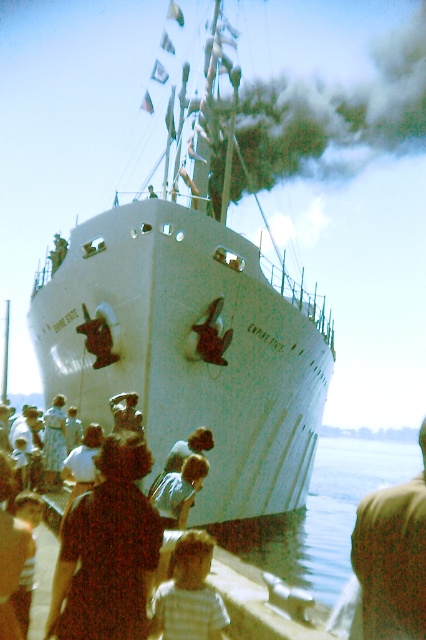
Question: Which is farther from the clear water at lower center?

Choices:
 (A) brown fabric at lower right
 (B) light brown fabric shirt at center

Answer: (A)

Question: Which point is farther to the camera?

Choices:
 (A) brown fabric at lower right
 (B) light brown fabric shirt at center
 (C) white matte ship at center
 (D) floral dress at lower left

Answer: (C)

Question: Does floral dress at lower left have a larger size compared to brown fabric at lower right?

Choices:
 (A) no
 (B) yes

Answer: (A)

Question: Which object is closer to the camera taking this photo?

Choices:
 (A) light brown fabric shirt at center
 (B) clear water at lower center
 (C) striped cotton shirt at lower center

Answer: (C)

Question: Can you confirm if clear water at lower center is bigger than brown fabric at lower right?

Choices:
 (A) yes
 (B) no

Answer: (A)

Question: Does brown fabric at lower right have a lesser width compared to light brown fabric shirt at center?

Choices:
 (A) yes
 (B) no

Answer: (B)